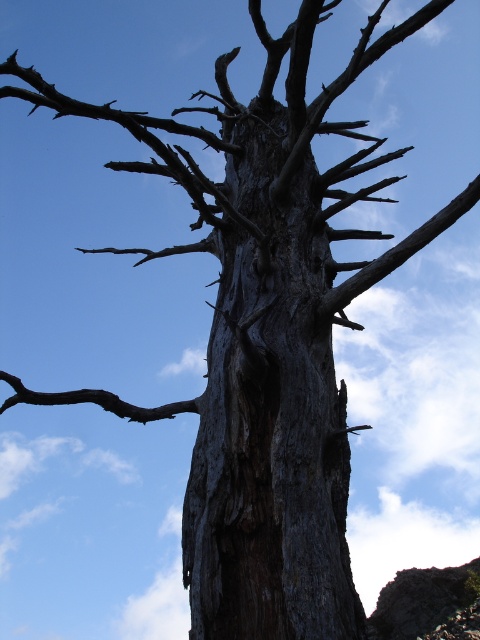
Which is behind, point (263, 179) or point (76, 401)?

Positioned behind is point (263, 179).

Measure the distance from dark gray bark tree trunk at center to brown rough branch at lower left.

The distance of dark gray bark tree trunk at center from brown rough branch at lower left is 3.49 feet.

What do you see at coordinates (269, 408) in the screenshot?
I see `dark gray bark tree trunk at center` at bounding box center [269, 408].

Image resolution: width=480 pixels, height=640 pixels. What are the coordinates of `dark gray bark tree trunk at center` in the screenshot? It's located at (269, 408).